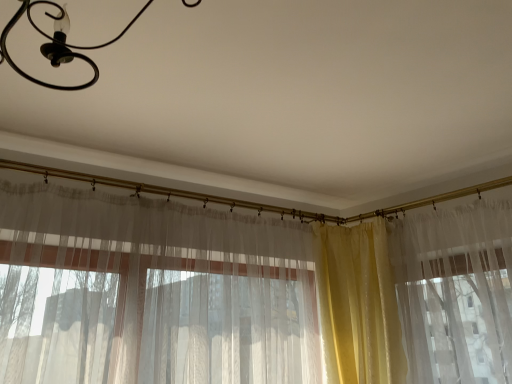
Question: From the image's perspective, relative to yellow satin curtain at right, which is the second curtain from left to right, is black matte chandelier at upper left above or below?

Choices:
 (A) above
 (B) below

Answer: (A)

Question: Considering the positions of point (64, 13) and point (339, 273), is point (64, 13) closer or farther from the camera than point (339, 273)?

Choices:
 (A) closer
 (B) farther

Answer: (A)

Question: Which object is the closest to the translucent fabric curtain at center, which is the first curtain in left-to-right order?

Choices:
 (A) black matte chandelier at upper left
 (B) yellow satin curtain at right, which is the 1th curtain from right to left

Answer: (B)

Question: Considering the real-world distances, which object is farthest from the yellow satin curtain at right, which is the second curtain from left to right?

Choices:
 (A) translucent fabric curtain at center, which is the first curtain in left-to-right order
 (B) black matte chandelier at upper left

Answer: (B)